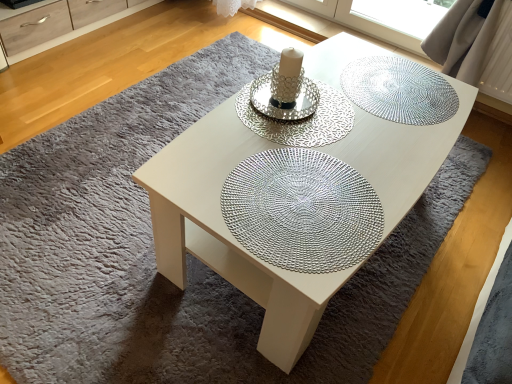
Where is `vacant region above silver textured doily at center, positioned as the 3th glass plate in back-to-front order (from a real-world perspective)`? vacant region above silver textured doily at center, positioned as the 3th glass plate in back-to-front order (from a real-world perspective) is located at coordinates (300, 192).